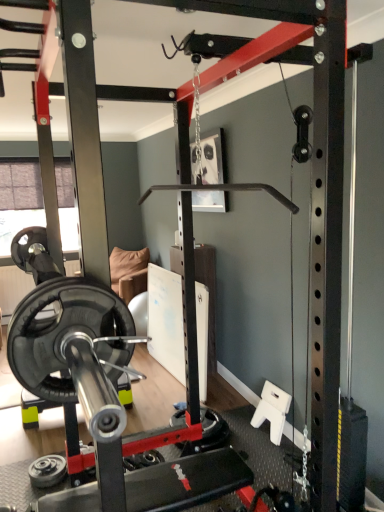
Question: Is black rubber weight plate at lower left, positioned as the 2th wheel in right-to-left order, smaller than black rubber wheel at center, the second wheel viewed from the left?

Choices:
 (A) no
 (B) yes

Answer: (B)

Question: Can you confirm if black rubber weight plate at lower left, which is the first wheel from left to right, is taller than black rubber wheel at center, the second wheel viewed from the left?

Choices:
 (A) no
 (B) yes

Answer: (A)

Question: Can you confirm if black rubber weight plate at lower left, which is the first wheel from left to right, is positioned to the left of black rubber wheel at center, the second wheel viewed from the left?

Choices:
 (A) yes
 (B) no

Answer: (A)

Question: From a real-world perspective, is black rubber weight plate at lower left, marked as the first wheel in a bottom-to-top arrangement, located beneath black rubber wheel at center, the second wheel viewed from the left?

Choices:
 (A) yes
 (B) no

Answer: (A)

Question: Is black rubber weight plate at lower left, the second wheel in the back-to-front sequence, positioned with its back to black rubber wheel at center, marked as the 2th wheel in a bottom-to-top arrangement?

Choices:
 (A) no
 (B) yes

Answer: (B)

Question: From the image's perspective, relative to black rubber barbell at center, is black rubber wheel at center, which is counted as the first wheel, starting from the back, above or below?

Choices:
 (A) above
 (B) below

Answer: (B)

Question: Choose the correct answer: Is black rubber wheel at center, which is counted as the first wheel, starting from the back, inside black rubber barbell at center or outside it?

Choices:
 (A) outside
 (B) inside

Answer: (A)

Question: Considering the positions of point (210, 434) and point (82, 396), is point (210, 434) closer or farther from the camera than point (82, 396)?

Choices:
 (A) closer
 (B) farther

Answer: (B)

Question: From a real-world perspective, is black rubber wheel at center, the second wheel viewed from the left, above or below black rubber barbell at center?

Choices:
 (A) above
 (B) below

Answer: (A)

Question: From a real-world perspective, is black rubber barbell at center positioned above or below black rubber wheel at center, the second wheel viewed from the left?

Choices:
 (A) below
 (B) above

Answer: (A)

Question: Which is correct: black rubber barbell at center is inside black rubber wheel at center, marked as the 2th wheel in a bottom-to-top arrangement, or outside of it?

Choices:
 (A) inside
 (B) outside

Answer: (B)

Question: Is black rubber barbell at center to the left or to the right of black rubber wheel at center, which is counted as the first wheel, starting from the back, in the image?

Choices:
 (A) right
 (B) left

Answer: (B)

Question: Is black rubber barbell at center wider or thinner than black rubber wheel at center, marked as the 2th wheel in a bottom-to-top arrangement?

Choices:
 (A) wide
 (B) thin

Answer: (A)

Question: Is black rubber weight plate at lower left, marked as the first wheel in a bottom-to-top arrangement, in front of or behind black rubber wheel at center, placed as the first wheel when sorted from top to bottom, in the image?

Choices:
 (A) front
 (B) behind

Answer: (A)

Question: Looking at the image, does black rubber weight plate at lower left, placed as the first wheel when sorted from front to back, seem bigger or smaller compared to black rubber wheel at center, acting as the second wheel starting from the front?

Choices:
 (A) small
 (B) big

Answer: (A)